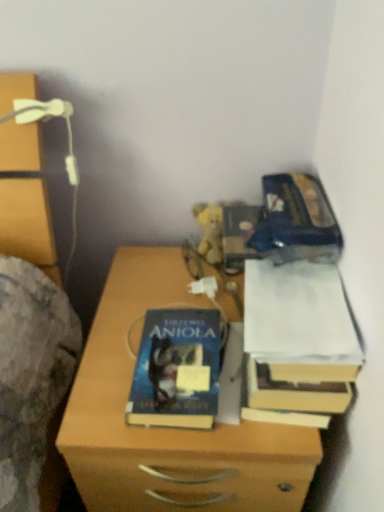
Question: From a real-world perspective, does wooden chest of drawers at left sit lower than hardcover book at center?

Choices:
 (A) yes
 (B) no

Answer: (B)

Question: From the image's perspective, is wooden chest of drawers at left on hardcover book at center?

Choices:
 (A) no
 (B) yes

Answer: (B)

Question: Is wooden chest of drawers at left shorter than hardcover book at center?

Choices:
 (A) no
 (B) yes

Answer: (A)

Question: Is wooden chest of drawers at left positioned in front of hardcover book at center?

Choices:
 (A) yes
 (B) no

Answer: (A)

Question: Does wooden chest of drawers at left have a greater height compared to hardcover book at center?

Choices:
 (A) yes
 (B) no

Answer: (A)

Question: Choose the correct answer: Is hardcover book at center inside white paper at right or outside it?

Choices:
 (A) outside
 (B) inside

Answer: (A)

Question: Considering their positions, is hardcover book at center located in front of or behind white paper at right?

Choices:
 (A) behind
 (B) front

Answer: (A)

Question: Is point (153, 309) positioned closer to the camera than point (246, 304)?

Choices:
 (A) closer
 (B) farther

Answer: (B)

Question: Is hardcover book at center bigger or smaller than white paper at right?

Choices:
 (A) big
 (B) small

Answer: (B)

Question: From the image's perspective, is wooden nightstand at center positioned above or below white paper at right?

Choices:
 (A) above
 (B) below

Answer: (B)

Question: Considering the positions of wooden nightstand at center and white paper at right in the image, is wooden nightstand at center wider or thinner than white paper at right?

Choices:
 (A) thin
 (B) wide

Answer: (B)

Question: Is wooden nightstand at center in front of or behind white paper at right in the image?

Choices:
 (A) front
 (B) behind

Answer: (A)

Question: Choose the correct answer: Is wooden nightstand at center inside white paper at right or outside it?

Choices:
 (A) outside
 (B) inside

Answer: (A)

Question: Is white paper at right inside or outside of wooden chest of drawers at left?

Choices:
 (A) inside
 (B) outside

Answer: (B)

Question: Does point (339, 290) appear closer or farther from the camera than point (3, 197)?

Choices:
 (A) closer
 (B) farther

Answer: (A)